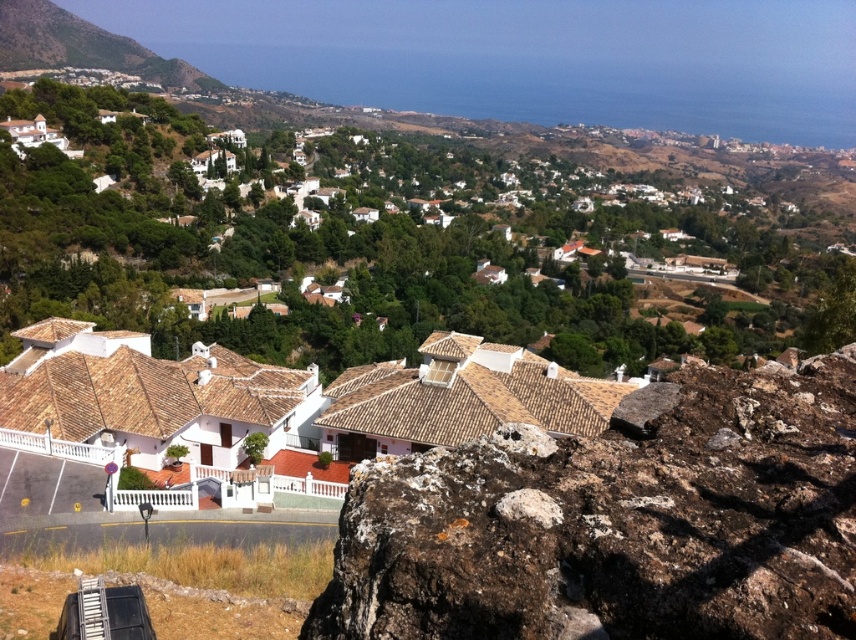
You are a hiker standing on the rocky outcrop in the foreground of the scene. You want to reach the green grassy hillside at upper left but need to pass by the white tile roof houses at lower left first. Given the distance between them, will you have to walk more than half a kilometer to reach the hillside from the houses?

The white tile roof houses at lower left is 441.44 meters from the green grassy hillside at upper left. Since 441.44 meters is less than 500 meters, you will not have to walk more than half a kilometer to reach the green grassy hillside at upper left from the white tile roof houses at lower left.